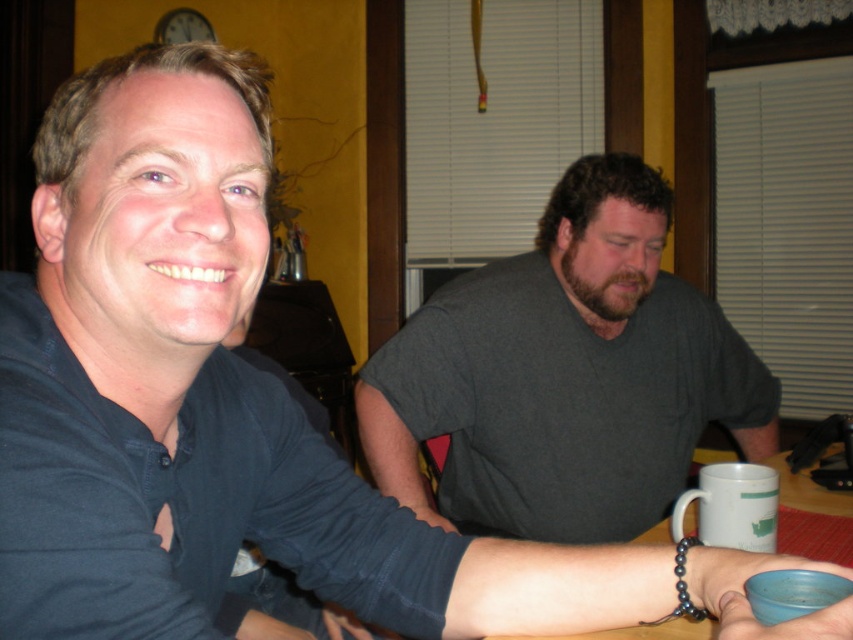
Is point (509, 474) closer to viewer compared to point (712, 474)?

No, (509, 474) is further to viewer.

Can you confirm if gray matte shirt at center is positioned to the left of white matte mug at lower right?

Indeed, gray matte shirt at center is positioned on the left side of white matte mug at lower right.

Describe the element at coordinates (566, 376) in the screenshot. The width and height of the screenshot is (853, 640). I see `gray matte shirt at center` at that location.

The height and width of the screenshot is (640, 853). Identify the location of gray matte shirt at center. (566, 376).

Who is more forward, (543, 444) or (813, 496)?

Point (813, 496) is in front.

Between point (631, 291) and point (637, 636), which one is positioned behind?

Point (631, 291)

Who is more distant from viewer, (666, 372) or (846, 499)?

Positioned behind is point (666, 372).

Find the location of a particular element. Image resolution: width=853 pixels, height=640 pixels. gray matte shirt at center is located at coordinates (566, 376).

Where is `white matte mug at lower right`? This screenshot has width=853, height=640. white matte mug at lower right is located at coordinates (732, 506).

Does white matte mug at lower right appear on the right side of wooden table at lower right?

In fact, white matte mug at lower right is to the left of wooden table at lower right.

Between point (727, 536) and point (805, 496), which one is positioned in front?

Point (727, 536) is in front.

The height and width of the screenshot is (640, 853). Find the location of `white matte mug at lower right`. white matte mug at lower right is located at coordinates (732, 506).